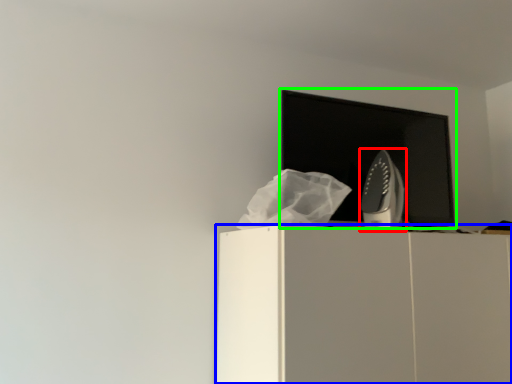
Question: Which is farther away from home appliance (highlighted by a red box)? furniture (highlighted by a blue box) or computer monitor (highlighted by a green box)?

Choices:
 (A) furniture
 (B) computer monitor

Answer: (A)